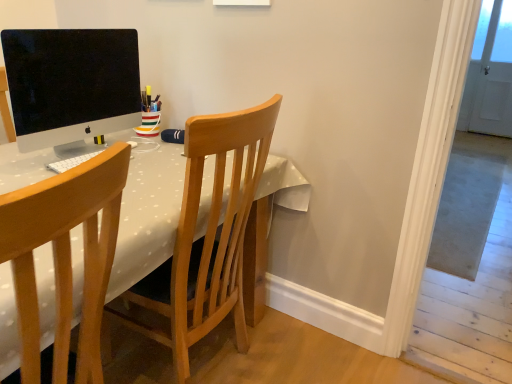
Image resolution: width=512 pixels, height=384 pixels. Identify the location of vacant area that lies to the right of white matte keyboard at center. (156, 164).